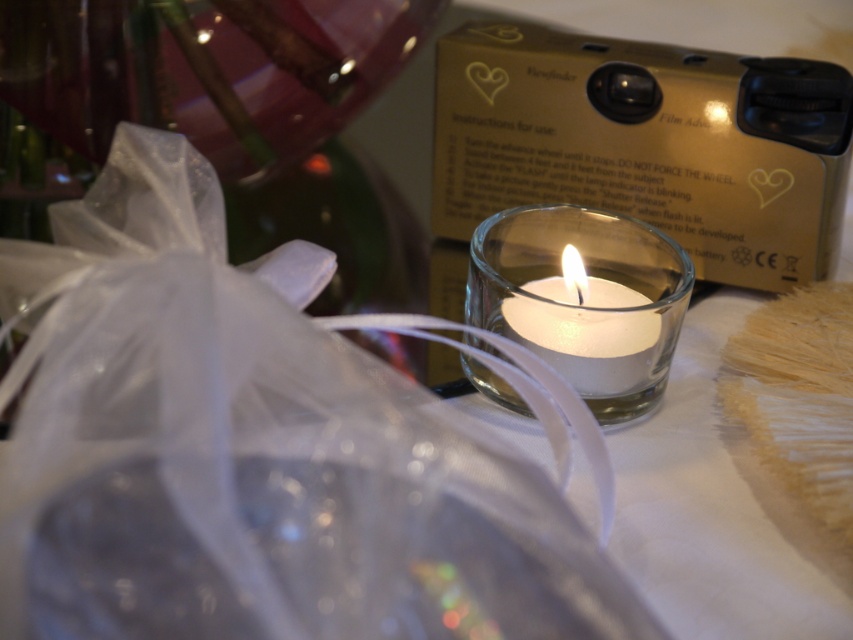
From the picture: Can you confirm if white satin ribbon at center is taller than white matte candle at center?

Indeed, white satin ribbon at center has a greater height compared to white matte candle at center.

Can you confirm if white satin ribbon at center is positioned to the left of white matte candle at center?

Correct, you'll find white satin ribbon at center to the left of white matte candle at center.

In order to click on white satin ribbon at center in this screenshot , I will do `click(250, 451)`.

What are the coordinates of `white satin ribbon at center` in the screenshot? It's located at tap(250, 451).

Does white satin ribbon at center have a smaller size compared to transparent glass candle at center?

No.

Is point (193, 218) closer to viewer compared to point (462, 364)?

Yes, it is.

Identify the location of white satin ribbon at center. Image resolution: width=853 pixels, height=640 pixels. (250, 451).

Is transparent glass candle at center thinner than white matte candle at center?

No.

Who is lower down, transparent glass candle at center or white matte candle at center?

Positioned lower is white matte candle at center.

Which is in front, point (521, 289) or point (604, 394)?

Positioned in front is point (604, 394).

The image size is (853, 640). In order to click on transparent glass candle at center in this screenshot , I will do `click(584, 300)`.